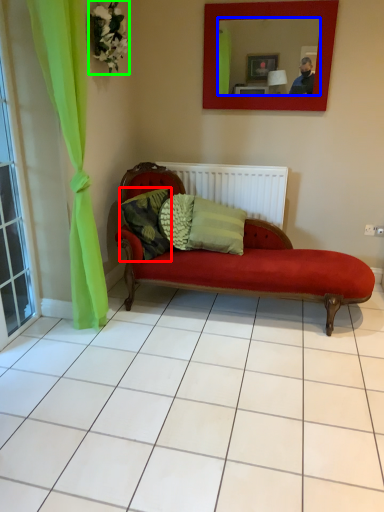
Question: Estimate the real-world distances between objects in this image. Which object is closer to pillow (highlighted by a red box), mirror (highlighted by a blue box) or flower (highlighted by a green box)?

Choices:
 (A) mirror
 (B) flower

Answer: (B)